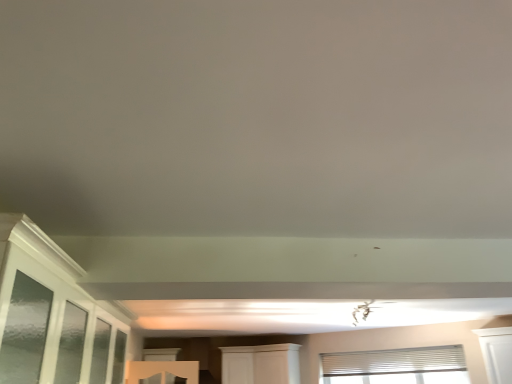
At what (x,y) coordinates should I click in order to perform the action: click on white textured blinds at upper right, the 1th window in the right-to-left sequence. Please return your answer as a coordinate pair (x, y). Looking at the image, I should click on (397, 366).

From a real-world perspective, is white wood cabinet at center physically located above or below white textured blinds at upper right, the 1th window in the right-to-left sequence?

In terms of real-world spatial position, white wood cabinet at center is above white textured blinds at upper right, the 1th window in the right-to-left sequence.

From the image's perspective, between white wood cabinet at center and white textured blinds at upper right, marked as the 2th window in a left-to-right arrangement, which one is located above?

white textured blinds at upper right, marked as the 2th window in a left-to-right arrangement, is shown above in the image.

Does white wood cabinet at center lie behind white textured blinds at upper right, marked as the 2th window in a left-to-right arrangement?

Yes, white wood cabinet at center is behind white textured blinds at upper right, marked as the 2th window in a left-to-right arrangement.

Is white textured blinds at upper right, the 1th window in the right-to-left sequence, in front of or behind clear glass window at lower center, the 1th window in the left-to-right sequence, in the image?

white textured blinds at upper right, the 1th window in the right-to-left sequence, is in front of clear glass window at lower center, the 1th window in the left-to-right sequence.

There is a white textured blinds at upper right, marked as the 2th window in a left-to-right arrangement. Find the location of `window above it (from a real-world perspective)`. window above it (from a real-world perspective) is located at coordinates (160, 354).

Is clear glass window at lower center, which is the 2th window from right to left, located within white textured blinds at upper right, marked as the 2th window in a left-to-right arrangement?

No, clear glass window at lower center, which is the 2th window from right to left, is not a part of white textured blinds at upper right, marked as the 2th window in a left-to-right arrangement.

Considering the positions of points (437, 354) and (162, 355), is point (437, 354) farther from camera compared to point (162, 355)?

No.

Based on their sizes in the image, would you say clear glass window at lower center, the 1th window in the left-to-right sequence, is bigger or smaller than white textured blinds at upper right, the 1th window in the right-to-left sequence?

Considering their sizes, clear glass window at lower center, the 1th window in the left-to-right sequence, takes up more space than white textured blinds at upper right, the 1th window in the right-to-left sequence.

Which object is further away from the camera, clear glass window at lower center, the 1th window in the left-to-right sequence, or white textured blinds at upper right, marked as the 2th window in a left-to-right arrangement?

clear glass window at lower center, the 1th window in the left-to-right sequence.

Where is `window that is behind the white textured blinds at upper right, the 1th window in the right-to-left sequence`? This screenshot has width=512, height=384. window that is behind the white textured blinds at upper right, the 1th window in the right-to-left sequence is located at coordinates (160, 354).

How different are the orientations of clear glass window at lower center, which is the 2th window from right to left, and white textured blinds at upper right, the 1th window in the right-to-left sequence, in degrees?

The angle between the facing direction of clear glass window at lower center, which is the 2th window from right to left, and the facing direction of white textured blinds at upper right, the 1th window in the right-to-left sequence, is 34.5 degrees.

Is white textured blinds at upper right, the 1th window in the right-to-left sequence, facing towards white wood cabinet at center?

No, white textured blinds at upper right, the 1th window in the right-to-left sequence, is not turned towards white wood cabinet at center.

This screenshot has height=384, width=512. What are the coordinates of `cabinetry below the white textured blinds at upper right, marked as the 2th window in a left-to-right arrangement (from the image's perspective)` in the screenshot? It's located at (261, 364).

Does point (443, 347) come closer to viewer compared to point (250, 351)?

Yes, it is in front of point (250, 351).

Does white wood cabinet at center have a greater width compared to clear glass window at lower center, the 1th window in the left-to-right sequence?

Indeed, white wood cabinet at center has a greater width compared to clear glass window at lower center, the 1th window in the left-to-right sequence.

From a real-world perspective, which object rests below the other?

white wood cabinet at center.

Is clear glass window at lower center, the 1th window in the left-to-right sequence, positioned beyond the bounds of white wood cabinet at center?

clear glass window at lower center, the 1th window in the left-to-right sequence, lies outside white wood cabinet at center's area.

Is the depth of clear glass window at lower center, which is the 2th window from right to left, greater than that of white wood cabinet at center?

That is True.

Considering the sizes of clear glass window at lower center, which is the 2th window from right to left, and white wood cabinet at center in the image, is clear glass window at lower center, which is the 2th window from right to left, taller or shorter than white wood cabinet at center?

Clearly, clear glass window at lower center, which is the 2th window from right to left, is shorter compared to white wood cabinet at center.

Which is farther from the camera, [164,355] or [250,377]?

The point [164,355] is behind.

Image resolution: width=512 pixels, height=384 pixels. Identify the location of cabinetry that is on the left side of white textured blinds at upper right, marked as the 2th window in a left-to-right arrangement. (261, 364).

Find the location of a particular element. The image size is (512, 384). window above the clear glass window at lower center, the 1th window in the left-to-right sequence (from the image's perspective) is located at coordinates (397, 366).

From the image, which object appears to be farther from white textured blinds at upper right, marked as the 2th window in a left-to-right arrangement, clear glass window at lower center, the 1th window in the left-to-right sequence, or white wood cabinet at center?

clear glass window at lower center, the 1th window in the left-to-right sequence.

Looking at the image, which one is located further to clear glass window at lower center, the 1th window in the left-to-right sequence, white wood cabinet at center or white textured blinds at upper right, the 1th window in the right-to-left sequence?

white textured blinds at upper right, the 1th window in the right-to-left sequence.

Based on their spatial positions, is clear glass window at lower center, the 1th window in the left-to-right sequence, or white textured blinds at upper right, the 1th window in the right-to-left sequence, closer to white wood cabinet at center?

white textured blinds at upper right, the 1th window in the right-to-left sequence, is closer to white wood cabinet at center.

Considering their positions, is white wood cabinet at center positioned closer to white textured blinds at upper right, marked as the 2th window in a left-to-right arrangement, than clear glass window at lower center, the 1th window in the left-to-right sequence?

A: Based on the image, white wood cabinet at center appears to be nearer to white textured blinds at upper right, marked as the 2th window in a left-to-right arrangement.

When comparing their distances from white wood cabinet at center, does white textured blinds at upper right, the 1th window in the right-to-left sequence, or clear glass window at lower center, which is the 2th window from right to left, seem closer?

white textured blinds at upper right, the 1th window in the right-to-left sequence, is positioned closer to the anchor white wood cabinet at center.

From the image, which object appears to be nearer to clear glass window at lower center, which is the 2th window from right to left, white textured blinds at upper right, marked as the 2th window in a left-to-right arrangement, or white wood cabinet at center?

white wood cabinet at center is closer to clear glass window at lower center, which is the 2th window from right to left.

Identify the location of cabinetry situated between clear glass window at lower center, which is the 2th window from right to left, and white textured blinds at upper right, marked as the 2th window in a left-to-right arrangement, from left to right. (261, 364).